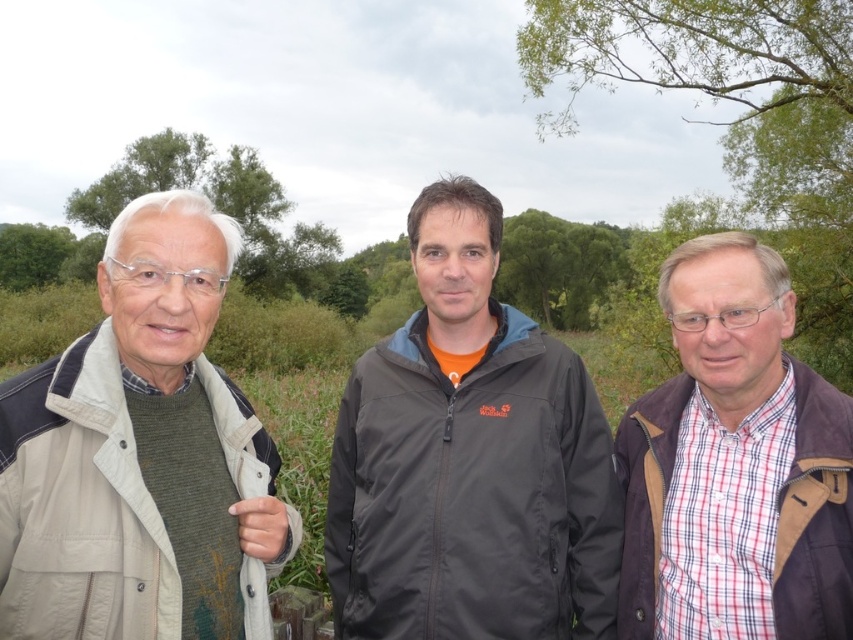
Consider the image. Is dark gray jacket at center further to camera compared to green leafy tree at center?

No, it is not.

Does dark gray jacket at center have a lesser width compared to green leafy tree at center?

Yes.

Locate an element on the screen. The height and width of the screenshot is (640, 853). dark gray jacket at center is located at coordinates (469, 460).

Between plaid fabric shirt at right and green leafy tree at upper center, which one has less height?

plaid fabric shirt at right is shorter.

At what (x,y) coordinates should I click in order to perform the action: click on plaid fabric shirt at right. Please return your answer as a coordinate pair (x, y). Looking at the image, I should click on point(735,465).

Image resolution: width=853 pixels, height=640 pixels. Identify the location of plaid fabric shirt at right. (735, 465).

Can you confirm if dark gray jacket at center is positioned to the right of green leafy branches at upper center?

In fact, dark gray jacket at center is to the left of green leafy branches at upper center.

Does dark gray jacket at center appear over green leafy branches at upper center?

Incorrect, dark gray jacket at center is not positioned above green leafy branches at upper center.

Is point (402, 344) behind point (815, 45)?

No.

I want to click on dark gray jacket at center, so click(x=469, y=460).